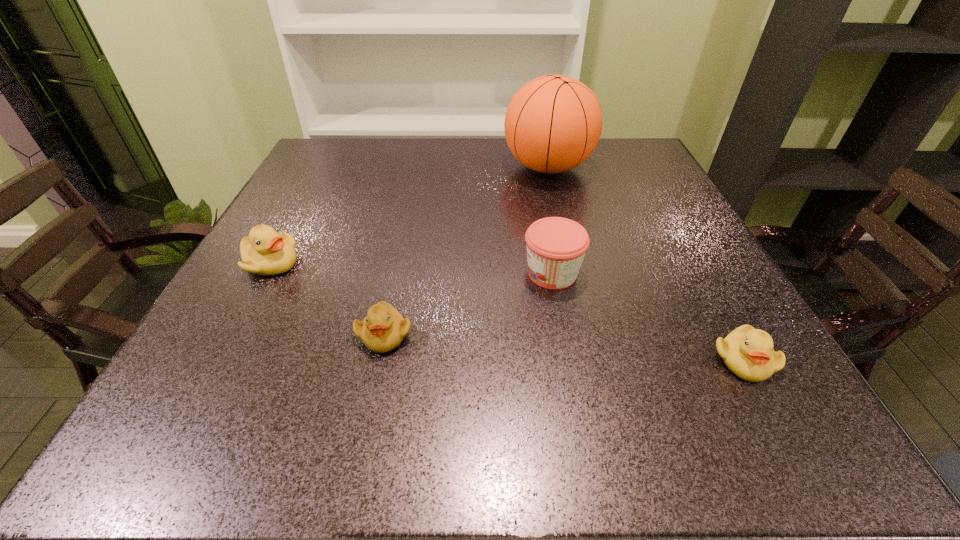
Locate an element on the screen. vacant area that lies between the second duckling from right to left and the rightmost duckling is located at coordinates (564, 347).

Where is `empty location between the basketball and the rightmost duckling`? This screenshot has height=540, width=960. empty location between the basketball and the rightmost duckling is located at coordinates (646, 264).

You are a GUI agent. You are given a task and a screenshot of the screen. Output one action in this format:
    pyautogui.click(x=<x>, y=<y>)
    Task: Click on the free space between the leftmost duckling and the jam
    
    Given the screenshot: What is the action you would take?
    pyautogui.click(x=411, y=268)

Where is `vacant space in between the leftmost object and the jam`? This screenshot has width=960, height=540. vacant space in between the leftmost object and the jam is located at coordinates (411, 268).

The height and width of the screenshot is (540, 960). What are the coordinates of `object that stands as the fourth closest to the jam` in the screenshot? It's located at (265, 252).

Select which object is the closest to the farthest object. Please provide its 2D coordinates. Your answer should be formatted as a tuple, i.e. [(x, y)], where the tuple contains the x and y coordinates of a point satisfying the conditions above.

[(556, 246)]

Choose which duckling is the nearest neighbor to the tallest object. Please provide its 2D coordinates. Your answer should be formatted as a tuple, i.e. [(x, y)], where the tuple contains the x and y coordinates of a point satisfying the conditions above.

[(383, 329)]

Identify the location of duckling that is the nearest to the farthest duckling. (383, 329).

Find the location of a particular element. vacant space that satisfies the following two spatial constraints: 1. on the front side of the basketball; 2. on the front-facing side of the leftmost object is located at coordinates (570, 263).

You are a GUI agent. You are given a task and a screenshot of the screen. Output one action in this format:
    pyautogui.click(x=<x>, y=<y>)
    Task: Click on the free space in the image that satisfies the following two spatial constraints: 1. on the front label of the jam; 2. at the beak of the second duckling from right to left
    
    Given the screenshot: What is the action you would take?
    pyautogui.click(x=564, y=335)